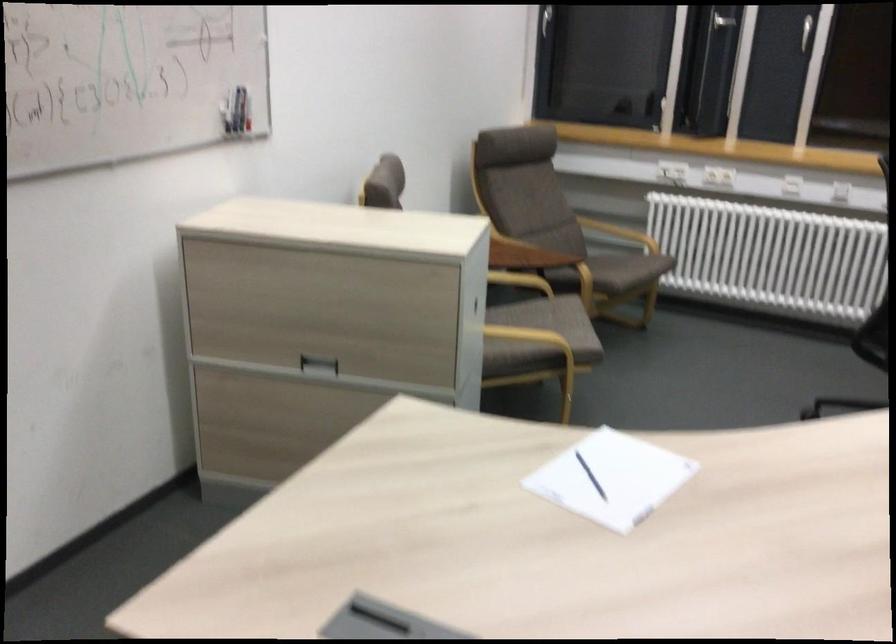
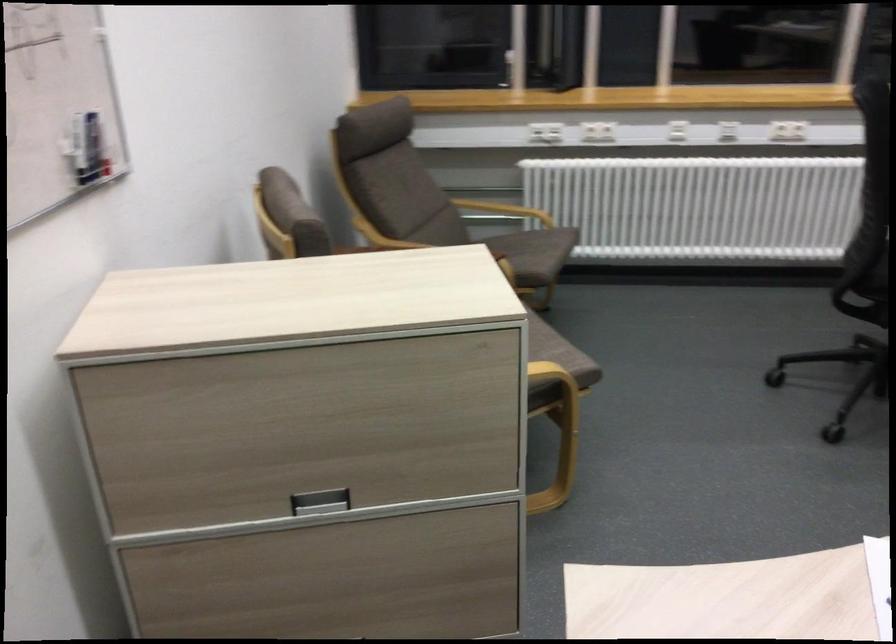
What movement of the cameraman would produce the second image?

The cameraman moved toward left, forward.